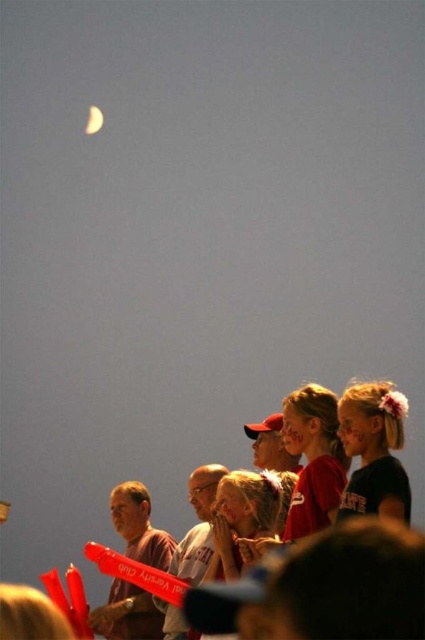
Which is in front, point (295, 433) or point (90, 131)?

Point (295, 433) is more forward.

Does matte red shirt at center have a greater height compared to shiny metallic crescent at upper left?

Correct, matte red shirt at center is much taller as shiny metallic crescent at upper left.

Find the location of a particular element. matte red shirt at center is located at coordinates (314, 458).

You are a GUI agent. You are given a task and a screenshot of the screen. Output one action in this format:
    pyautogui.click(x=<x>, y=<y>)
    Task: Click on the matte red shirt at center
    The width and height of the screenshot is (425, 640).
    Given the screenshot: What is the action you would take?
    pyautogui.click(x=314, y=458)

Is point (408, 480) positioned in front of point (96, 112)?

Yes, point (408, 480) is closer to viewer.

Who is more forward, (373, 440) or (90, 120)?

Point (373, 440)

Identify the location of matte black shirt at lower right. (374, 451).

Between point (367, 465) and point (323, 403), which one is positioned behind?

The point (323, 403) is more distant.

The width and height of the screenshot is (425, 640). Describe the element at coordinates (374, 451) in the screenshot. I see `matte black shirt at lower right` at that location.

Between point (391, 412) and point (291, 442), which one is positioned behind?

The point (291, 442) is behind.

Identify the location of matte black shirt at lower right. This screenshot has width=425, height=640. (374, 451).